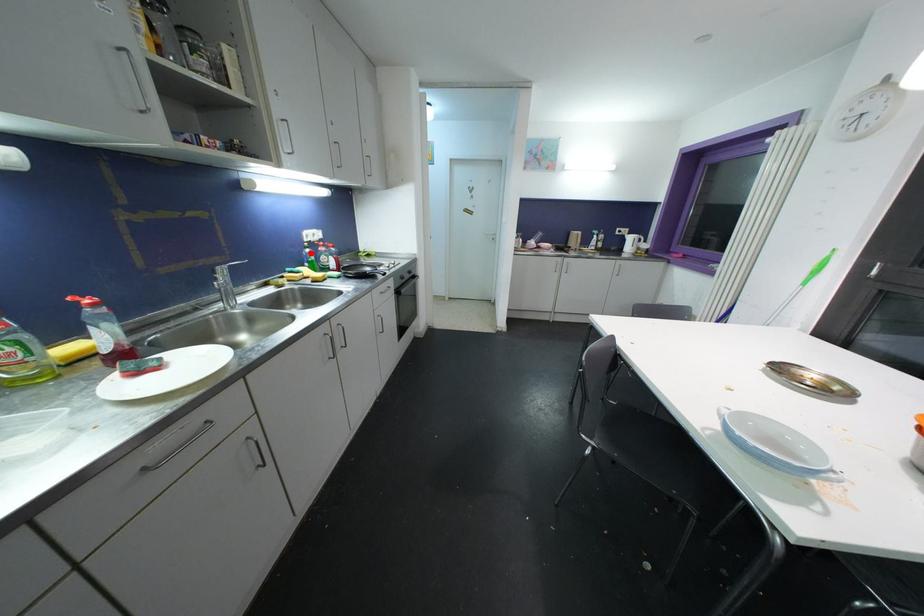
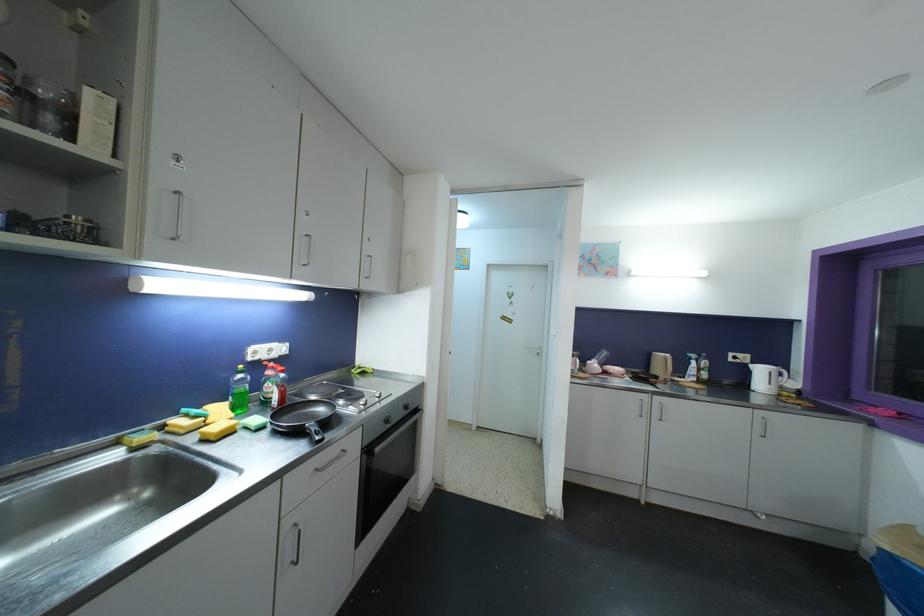
Where in the second image is the point corresponding to the highlighted location from the first image?

(244, 379)